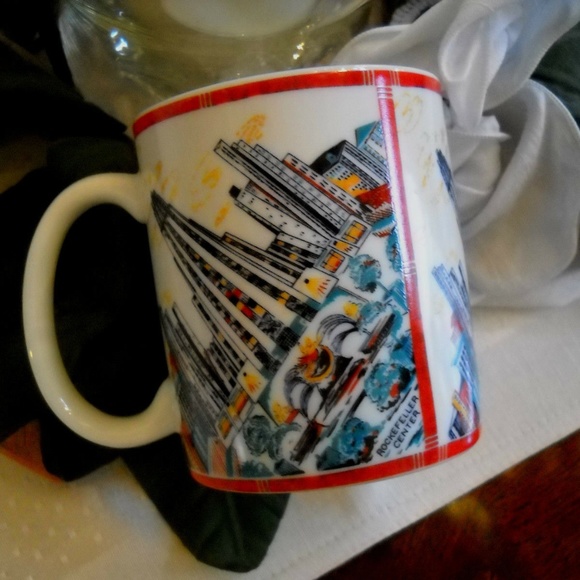
Locate an element on the screen. The image size is (580, 580). space inside cup handle perimeter is located at coordinates (112, 306).